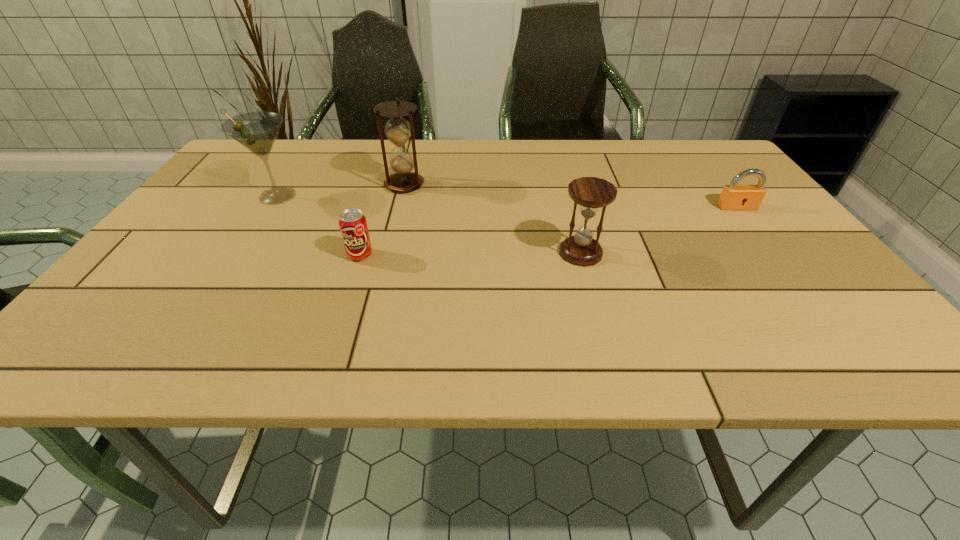
In order to click on object that is the closest to the left hourglass in this screenshot , I will do `click(257, 131)`.

Identify which object is located as the second nearest to the third shortest object. Please provide its 2D coordinates. Your answer should be formatted as a tuple, i.e. [(x, y)], where the tuple contains the x and y coordinates of a point satisfying the conditions above.

[(398, 130)]